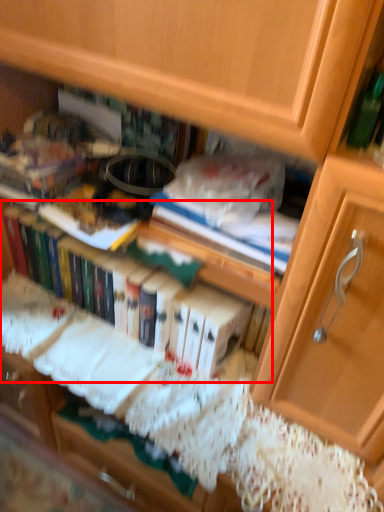
Question: From the image's perspective, where is book (annotated by the red box) located in relation to paperback book in the image?

Choices:
 (A) above
 (B) below

Answer: (B)